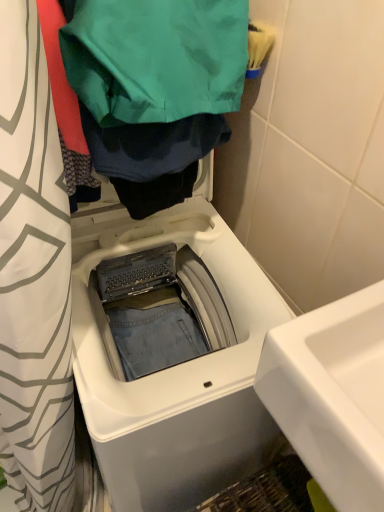
Question: From a real-world perspective, is green fabric bag at upper center located beneath white plastic washing machine at center?

Choices:
 (A) no
 (B) yes

Answer: (A)

Question: Is the position of green fabric bag at upper center more distant than that of white plastic washing machine at center?

Choices:
 (A) no
 (B) yes

Answer: (A)

Question: Is green fabric bag at upper center taller than white plastic washing machine at center?

Choices:
 (A) yes
 (B) no

Answer: (B)

Question: Does green fabric bag at upper center come in front of white plastic washing machine at center?

Choices:
 (A) yes
 (B) no

Answer: (A)

Question: Is green fabric bag at upper center positioned far away from white plastic washing machine at center?

Choices:
 (A) no
 (B) yes

Answer: (A)

Question: In terms of height, does white glossy sink at lower right look taller or shorter compared to white plastic washing machine at center?

Choices:
 (A) short
 (B) tall

Answer: (A)

Question: Is white glossy sink at lower right wider or thinner than white plastic washing machine at center?

Choices:
 (A) wide
 (B) thin

Answer: (B)

Question: Is point (355, 301) positioned closer to the camera than point (253, 323)?

Choices:
 (A) closer
 (B) farther

Answer: (A)

Question: Is white glossy sink at lower right bigger or smaller than white plastic washing machine at center?

Choices:
 (A) big
 (B) small

Answer: (B)

Question: Looking at their shapes, would you say green fabric bag at upper center is wider or thinner than white plastic washing machine at center?

Choices:
 (A) wide
 (B) thin

Answer: (B)

Question: Is green fabric bag at upper center in front of or behind white plastic washing machine at center in the image?

Choices:
 (A) front
 (B) behind

Answer: (A)

Question: Would you say green fabric bag at upper center is inside or outside white plastic washing machine at center?

Choices:
 (A) inside
 (B) outside

Answer: (B)

Question: Considering the positions of point (147, 41) and point (206, 496), is point (147, 41) closer or farther from the camera than point (206, 496)?

Choices:
 (A) farther
 (B) closer

Answer: (B)

Question: From their relative heights in the image, would you say white plastic washing machine at center is taller or shorter than white glossy sink at lower right?

Choices:
 (A) short
 (B) tall

Answer: (B)

Question: From a real-world perspective, is white plastic washing machine at center positioned above or below white glossy sink at lower right?

Choices:
 (A) below
 (B) above

Answer: (A)